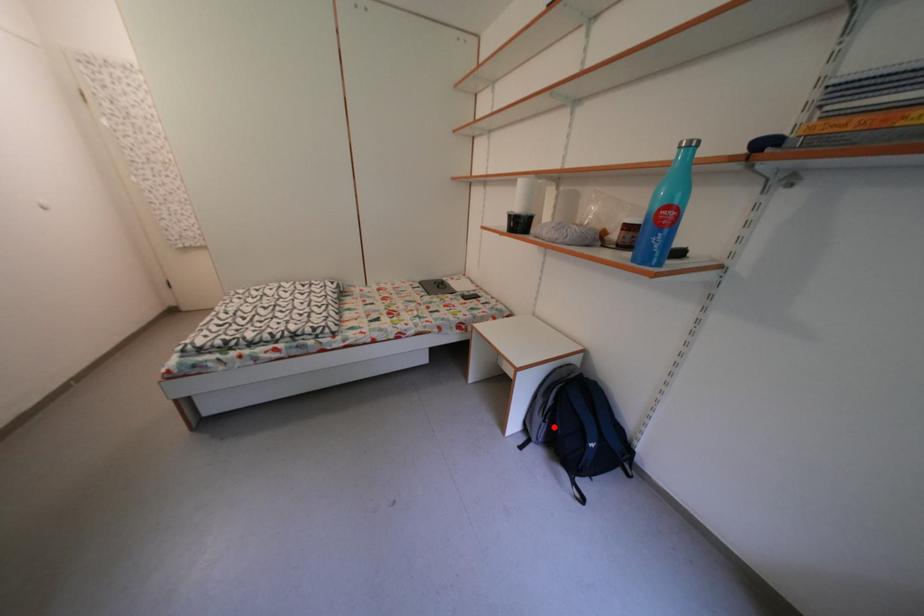
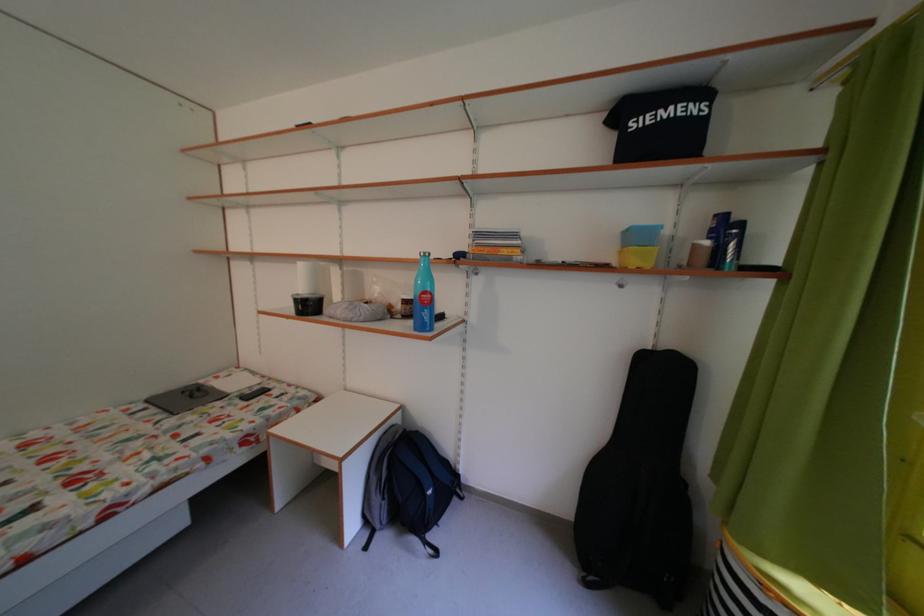
Find the pixel in the second image that matches the highlighted location in the first image.

(393, 504)